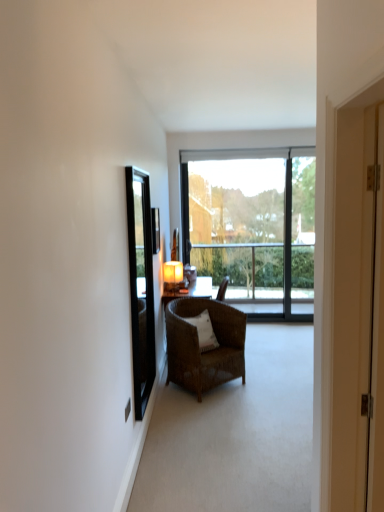
Question: Choose the correct answer: Is clear glass mirror at left inside white woven pillow at center or outside it?

Choices:
 (A) outside
 (B) inside

Answer: (A)

Question: Based on their sizes in the image, would you say clear glass mirror at left is bigger or smaller than white woven pillow at center?

Choices:
 (A) big
 (B) small

Answer: (A)

Question: Which object is the closest to the matte yellow lampshade at center?

Choices:
 (A) matte black screen door at right
 (B) woven brown chair at center
 (C) white woven pillow at center
 (D) white wooden door at right
 (E) clear glass mirror at left

Answer: (C)

Question: Estimate the real-world distances between objects in this image. Which object is closer to the white woven pillow at center?

Choices:
 (A) white wooden door at right
 (B) transparent glass window at center
 (C) woven brown chair at center
 (D) matte yellow lampshade at center
 (E) clear glass mirror at left

Answer: (C)